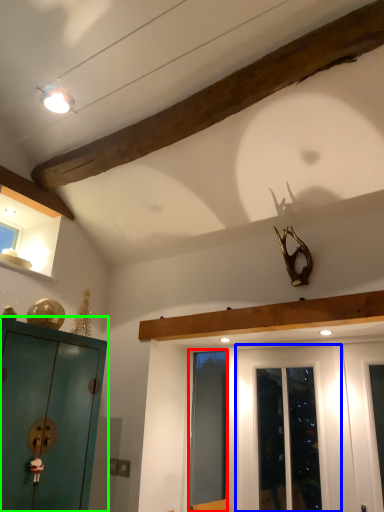
Question: Based on their relative distances, which object is nearer to screen door (highlighted by a red box)? Choose from door (highlighted by a blue box) and cabinetry (highlighted by a green box).

Choices:
 (A) door
 (B) cabinetry

Answer: (A)